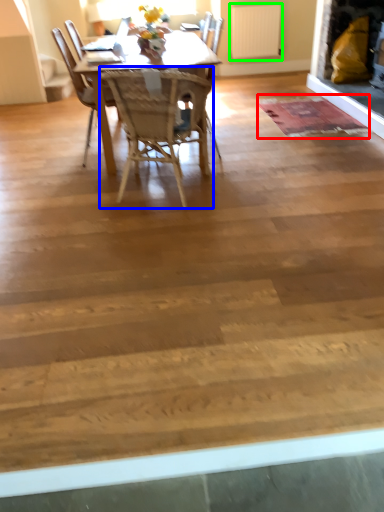
Question: Considering the real-world distances, which object is closest to mat (highlighted by a red box)? chair (highlighted by a blue box) or radiator (highlighted by a green box).

Choices:
 (A) chair
 (B) radiator

Answer: (A)